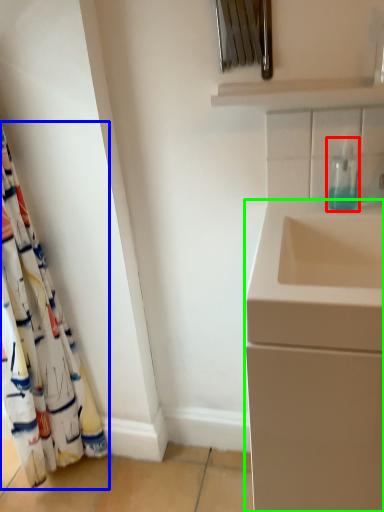
Question: Which object is positioned closest to soap dispenser (highlighted by a red box)? Select from curtain (highlighted by a blue box) and bathroom cabinet (highlighted by a green box).

Choices:
 (A) curtain
 (B) bathroom cabinet

Answer: (B)